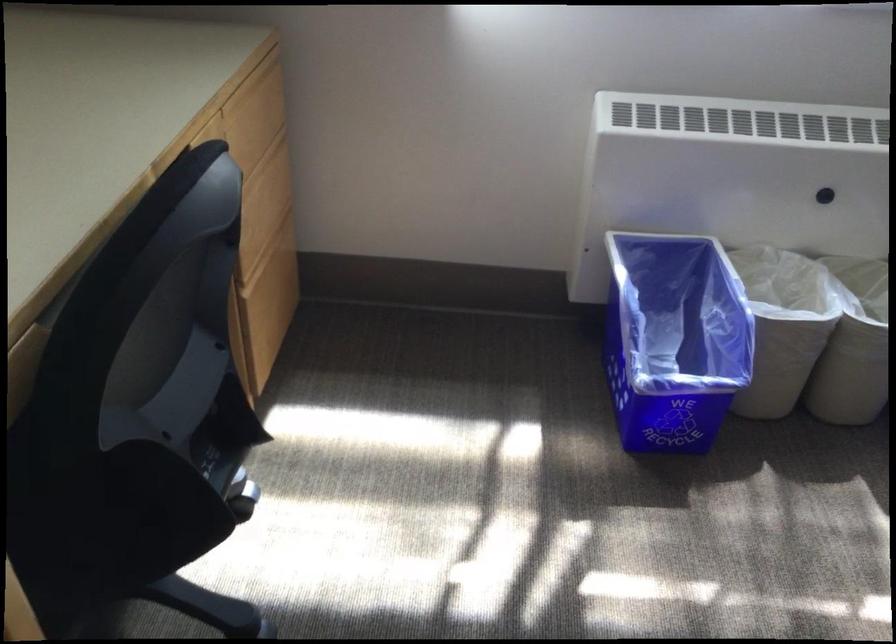
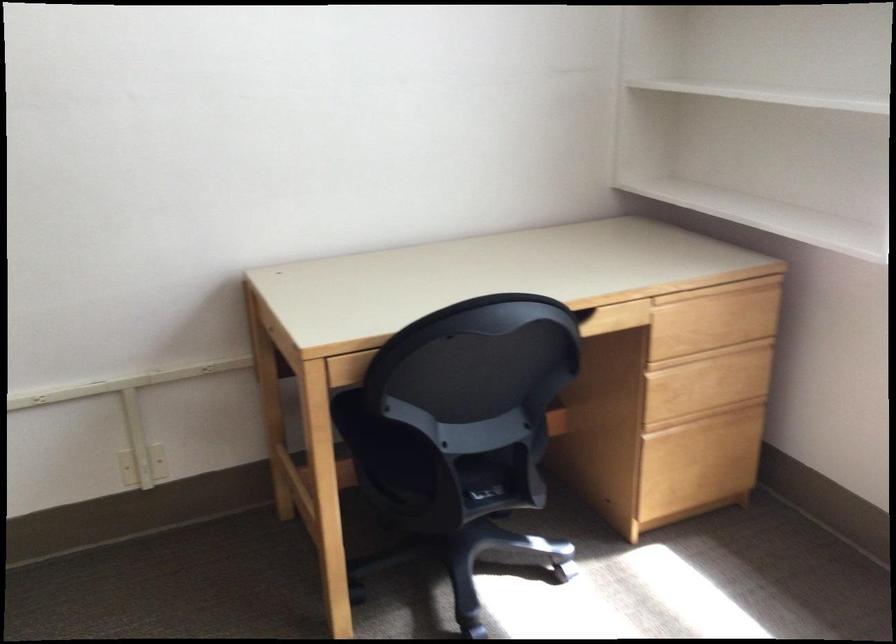
Locate, in the second image, the point that corresponds to the point at 255,164 in the first image.

(700, 346)